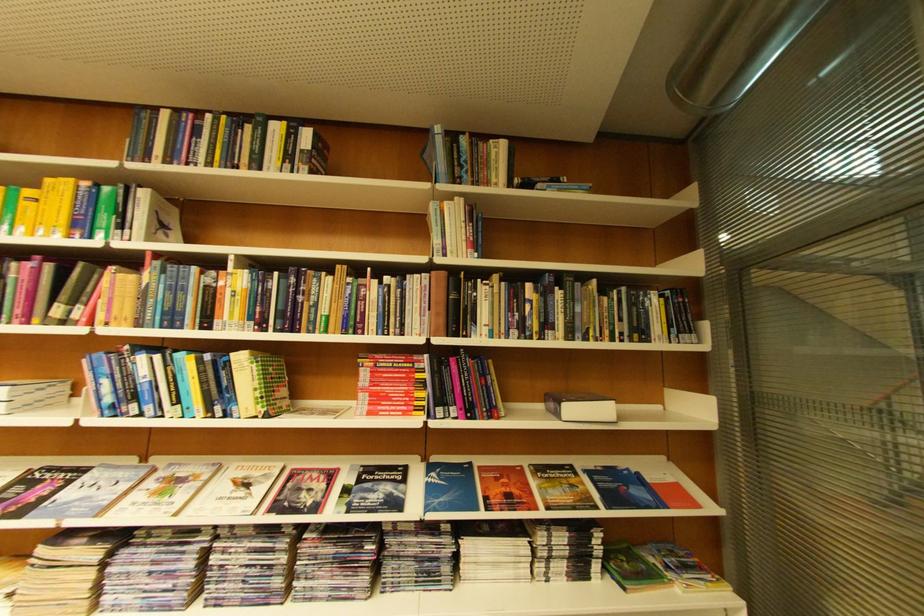
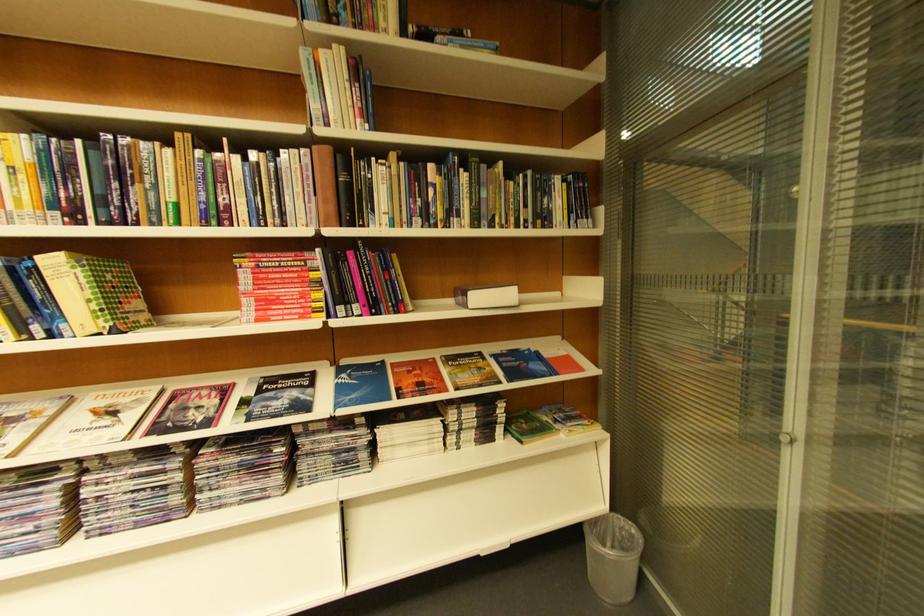
Find the pixel in the second image that matches pixel 453 310 in the first image.

(342, 196)